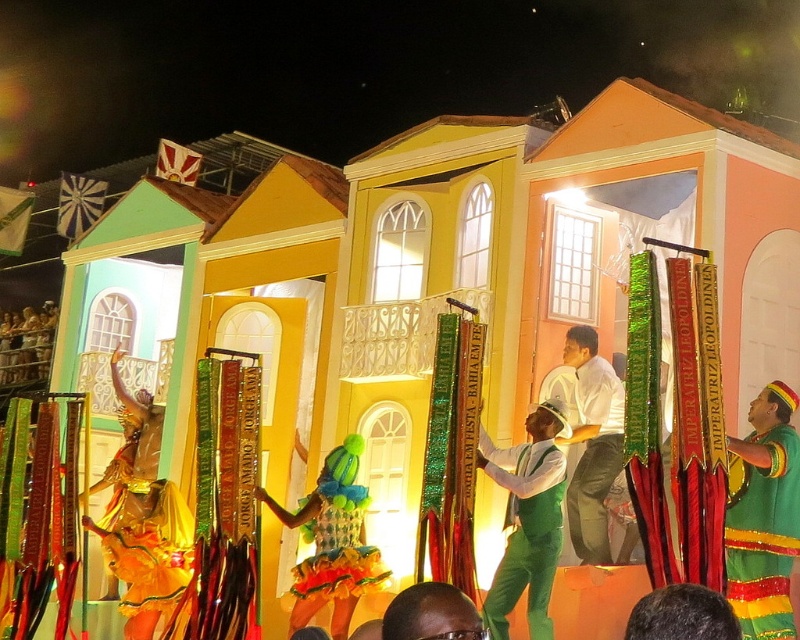
Is green fabric at center shorter than white glossy shirt at center?

Correct, green fabric at center is not as tall as white glossy shirt at center.

Is point (548, 451) in front of point (616, 442)?

That is True.

Between point (546, 444) and point (594, 512), which one is positioned in front?

Point (546, 444) is in front.

Where is `green fabric at center`? green fabric at center is located at coordinates (528, 520).

Is shiny metallic costume at center thinner than white glossy shirt at center?

Incorrect, shiny metallic costume at center's width is not less than white glossy shirt at center's.

Is the position of shiny metallic costume at center more distant than that of white glossy shirt at center?

That is True.

Who is more distant from viewer, (x=294, y=515) or (x=570, y=481)?

Positioned behind is point (x=294, y=515).

I want to click on shiny metallic costume at center, so click(x=332, y=541).

Which is more to the left, green fabric at center or shiny metallic costume at center?

shiny metallic costume at center is more to the left.

Does green fabric at center lie in front of shiny metallic costume at center?

Yes.

Measure the distance between point (544,520) and camera.

A distance of 49.15 meters exists between point (544,520) and camera.

The image size is (800, 640). Find the location of `green fabric at center`. green fabric at center is located at coordinates (528, 520).